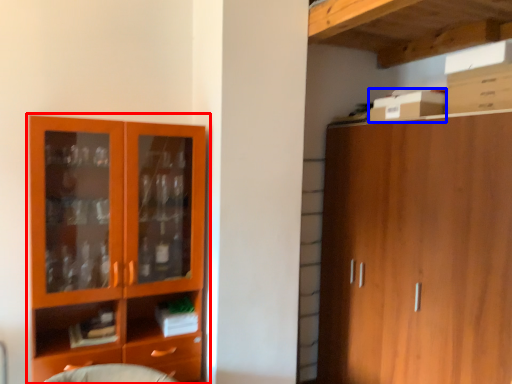
Question: Which object appears closest to the camera in this image, cupboard (highlighted by a red box) or cardboard box (highlighted by a blue box)?

Choices:
 (A) cupboard
 (B) cardboard box

Answer: (A)